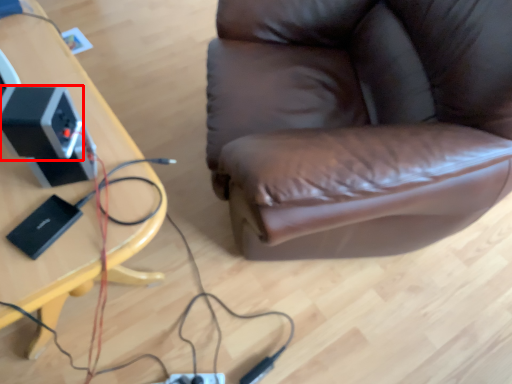
Question: From the image's perspective, where is speaker (annotated by the red box) located relative to table?

Choices:
 (A) below
 (B) above

Answer: (B)